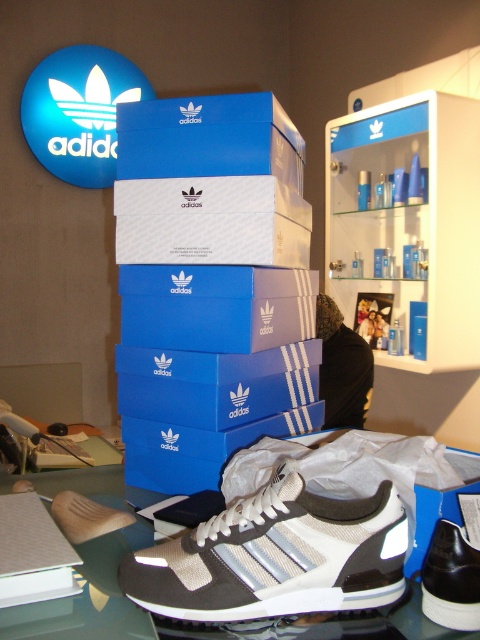
From the picture: You are a store employee arranging Adidas products. You need to place a new Adidas shoebox in the display so that it doesn not block the view of the white textured sneaker at center. Where should you place the shoebox relative to the sneaker?

The white textured sneaker at center is located at point (276, 556) in the image. To avoid blocking its view, the new shoebox should be placed either behind or to the sides of the sneaker, ensuring it remains visible to customers.

You are a delivery person who needs to place a new shoebox onto the glass table where the white textured sneaker at center is currently located. The table has a maximum load capacity of 25 pounds. The blue matte shoebox at upper center weighs 3 pounds, and the sneaker weighs 1.5 pounds. Can you safely place the new shoebox on the table without exceeding the weight limit?

The total weight of the white textured sneaker at center and the blue matte shoebox at upper center is 4.5 pounds. Adding the new shoebox, which weighs 3 pounds, would result in a total of 7.5 pounds. Since this is under the table maximum load capacity of 25 pounds, it is safe to place the new shoebox on the table.

You are an Adidas store employee who wants to place a promotional sticker on the white textured sneaker at center. The sticker requires a flat surface area of at least 10 square centimeters. Based on the sneaker dimensions provided, can you confirm if the sneaker has enough space for the sticker?

The white textured sneaker at center has a surface area of 15 square centimeters, which is sufficient for the sticker requiring 10 square centimeters.